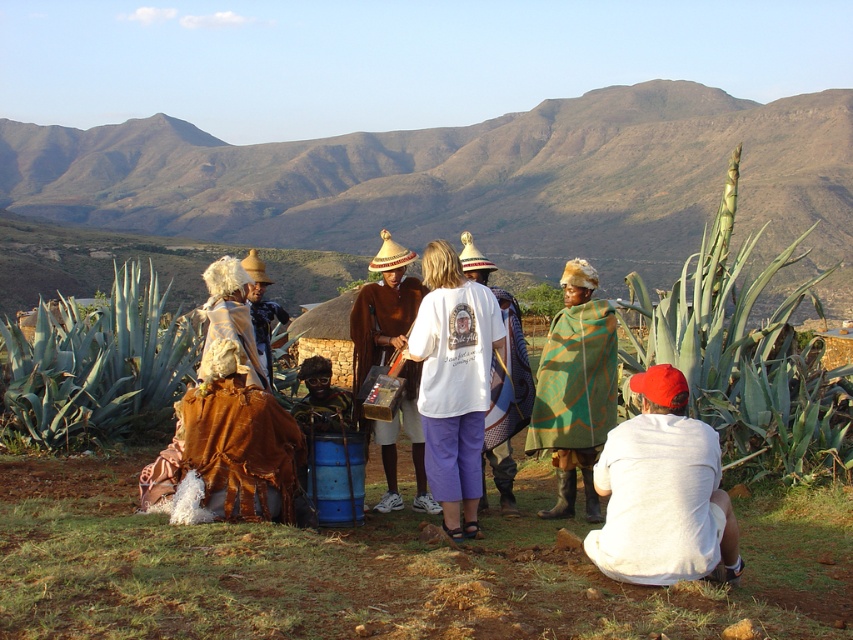
Which of these two, rugged brown mountain at upper center or white cotton shirt at center, stands shorter?

white cotton shirt at center is shorter.

Is point (196, 157) closer to viewer compared to point (497, 397)?

No.

Where is `rugged brown mountain at upper center`? Image resolution: width=853 pixels, height=640 pixels. rugged brown mountain at upper center is located at coordinates (474, 180).

Can you confirm if white cotton shirt at lower right is positioned above white cotton shirt at center?

Incorrect, white cotton shirt at lower right is not positioned above white cotton shirt at center.

Who is shorter, white cotton shirt at lower right or white cotton shirt at center?

white cotton shirt at lower right

Between point (717, 556) and point (492, 428), which one is positioned behind?

Positioned behind is point (492, 428).

Identify the location of white cotton shirt at lower right. (662, 492).

Does white cotton t-shirt at center appear on the left side of white cotton shirt at center?

Indeed, white cotton t-shirt at center is positioned on the left side of white cotton shirt at center.

Is white cotton t-shirt at center further to camera compared to white cotton shirt at center?

No.

Measure the distance between point [448,477] and camera.

Point [448,477] and camera are 8.00 meters apart from each other.

I want to click on white cotton t-shirt at center, so click(453, 381).